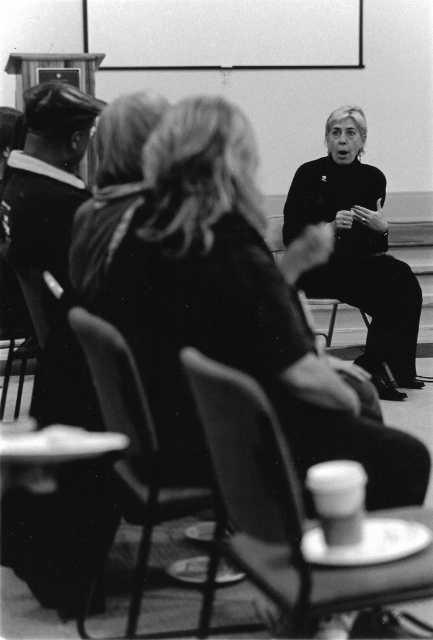
Question: Which of the following is the farthest from the observer?

Choices:
 (A) (246, 484)
 (B) (126, 433)

Answer: (B)

Question: Which object appears farthest from the camera in this image?

Choices:
 (A) black matte turtleneck at center
 (B) smooth black hat at left

Answer: (A)

Question: In this image, where is smooth plastic cup at lower center located relative to smooth plastic chair at center?

Choices:
 (A) above
 (B) below

Answer: (B)

Question: Is smooth plastic cup at lower center below black matte turtleneck at center?

Choices:
 (A) yes
 (B) no

Answer: (A)

Question: Which of these objects is positioned farthest from the black matte turtleneck at center?

Choices:
 (A) smooth black hat at left
 (B) smooth plastic cup at lower center
 (C) smooth plastic chair at center

Answer: (B)

Question: Observing the image, what is the correct spatial positioning of smooth plastic cup at lower center in reference to black matte turtleneck at center?

Choices:
 (A) below
 (B) above

Answer: (A)